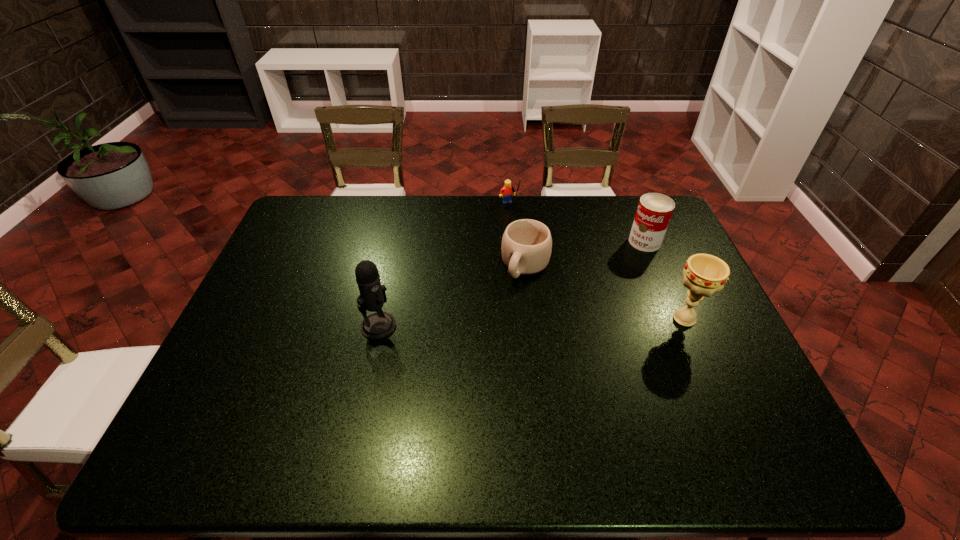
Locate an element on the screen. This screenshot has height=540, width=960. can that is at the right edge is located at coordinates (654, 211).

This screenshot has width=960, height=540. Find the location of `object at the far right corner`. object at the far right corner is located at coordinates (654, 211).

The width and height of the screenshot is (960, 540). What are the coordinates of `vacant space at the far edge of the desktop` in the screenshot? It's located at (518, 203).

The height and width of the screenshot is (540, 960). In the image, there is a desktop. Identify the location of free region at the near edge. (436, 406).

Locate an element on the screen. free space at the left edge of the desktop is located at coordinates (239, 316).

Find the location of a particular element. This screenshot has height=540, width=960. vacant space at the right edge of the desktop is located at coordinates (695, 334).

Locate an element on the screen. Image resolution: width=960 pixels, height=540 pixels. free region at the far left corner of the desktop is located at coordinates pyautogui.click(x=314, y=212).

This screenshot has width=960, height=540. In the image, there is a desktop. Identify the location of vacant space at the near left corner. (238, 394).

In the image, there is a desktop. At what (x,y) coordinates should I click in order to perform the action: click on vacant region at the far right corner. Please return your answer as a coordinate pair (x, y). This screenshot has height=540, width=960. Looking at the image, I should click on [633, 198].

The height and width of the screenshot is (540, 960). Find the location of `free space between the fourth shortest object and the mug`. free space between the fourth shortest object and the mug is located at coordinates (605, 292).